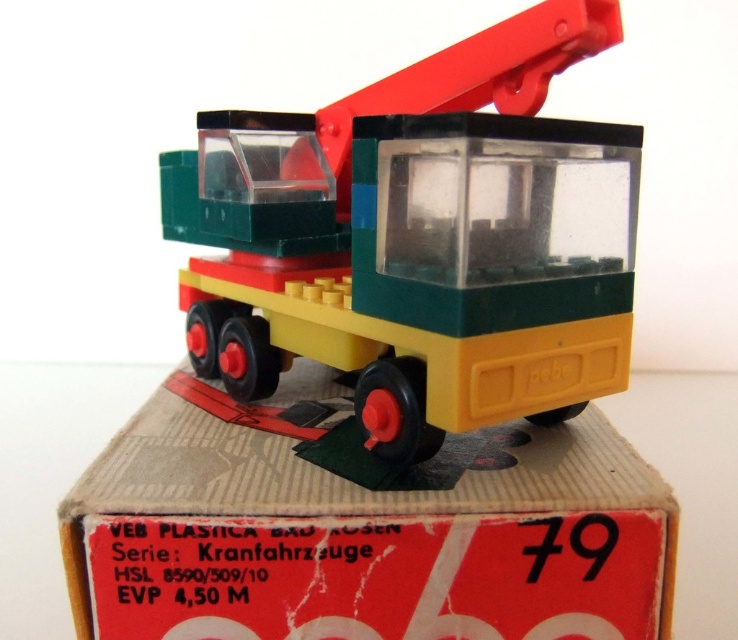
Which is more to the right, yellow matte truck at center or yellow plastic box at center?

yellow plastic box at center

Consider the image. Is yellow matte truck at center to the right of yellow plastic box at center from the viewer's perspective?

No, yellow matte truck at center is not to the right of yellow plastic box at center.

Where is `yellow matte truck at center`? The height and width of the screenshot is (640, 738). yellow matte truck at center is located at coordinates (413, 243).